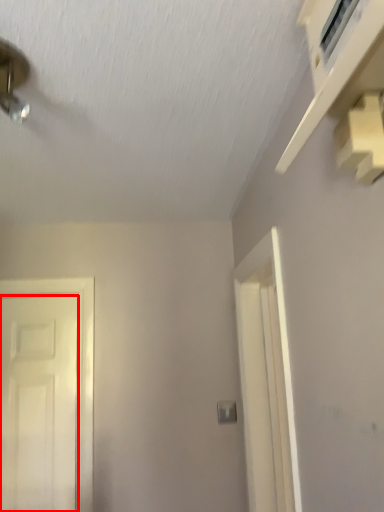
Question: From the image's perspective, what is the correct spatial relationship of door (annotated by the red box) in relation to light switch?

Choices:
 (A) below
 (B) above

Answer: (B)